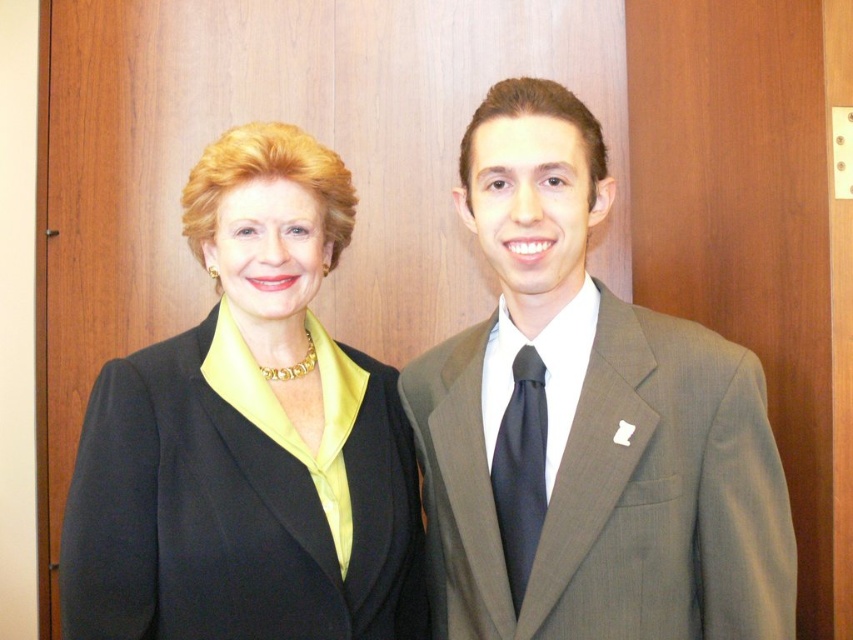
Is matte gray suit at center below black satin tie at center?

No.

Which is more to the right, matte gray suit at center or black satin tie at center?

From the viewer's perspective, matte gray suit at center appears more on the right side.

Locate an element on the screen. The width and height of the screenshot is (853, 640). matte gray suit at center is located at coordinates (587, 424).

Is matte gray suit at center behind black matte suit at left?

No, matte gray suit at center is in front of black matte suit at left.

Can you confirm if matte gray suit at center is positioned to the right of black matte suit at left?

Indeed, matte gray suit at center is positioned on the right side of black matte suit at left.

Is point (502, 300) farther from camera compared to point (256, 218)?

Yes, it is.

What are the coordinates of `matte gray suit at center` in the screenshot? It's located at pyautogui.click(x=587, y=424).

Is black matte suit at left below black satin tie at center?

Actually, black matte suit at left is above black satin tie at center.

Is black matte suit at left smaller than black satin tie at center?

No.

What do you see at coordinates (248, 436) in the screenshot?
I see `black matte suit at left` at bounding box center [248, 436].

Image resolution: width=853 pixels, height=640 pixels. I want to click on black matte suit at left, so click(x=248, y=436).